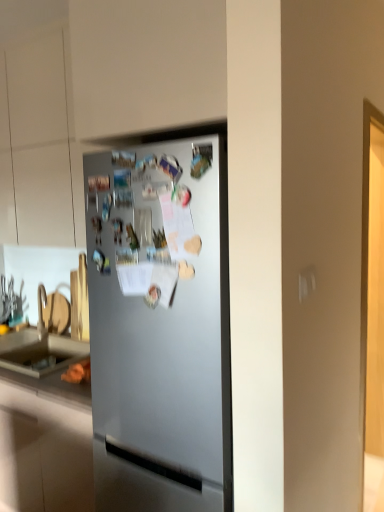
Question: Considering the relative positions of matte gray countertop at lower left and satin silver fridge at center in the image provided, is matte gray countertop at lower left to the left or to the right of satin silver fridge at center?

Choices:
 (A) left
 (B) right

Answer: (A)

Question: Is matte gray countertop at lower left taller or shorter than satin silver fridge at center?

Choices:
 (A) tall
 (B) short

Answer: (B)

Question: Considering the positions of point (71, 400) and point (132, 332), is point (71, 400) closer or farther from the camera than point (132, 332)?

Choices:
 (A) closer
 (B) farther

Answer: (B)

Question: Looking at the image, does satin silver fridge at center seem bigger or smaller compared to matte gray countertop at lower left?

Choices:
 (A) big
 (B) small

Answer: (A)

Question: From a real-world perspective, relative to matte gray countertop at lower left, is satin silver fridge at center vertically above or below?

Choices:
 (A) above
 (B) below

Answer: (A)

Question: In terms of height, does satin silver fridge at center look taller or shorter compared to matte gray countertop at lower left?

Choices:
 (A) short
 (B) tall

Answer: (B)

Question: Is satin silver fridge at center in front of or behind matte gray countertop at lower left in the image?

Choices:
 (A) behind
 (B) front

Answer: (B)